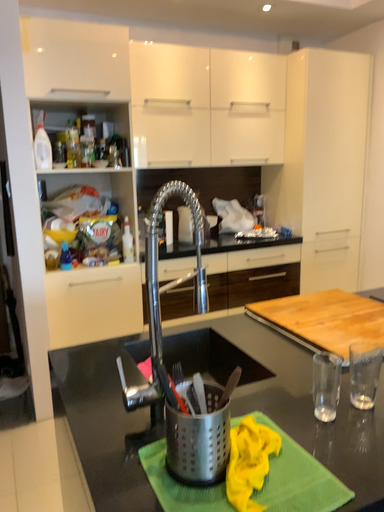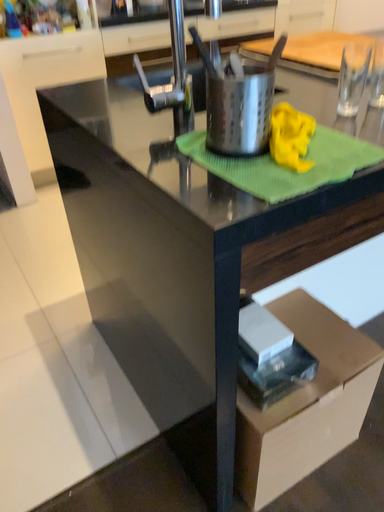
Question: Which way did the camera rotate in the video?

Choices:
 (A) rotated upward
 (B) rotated downward

Answer: (B)